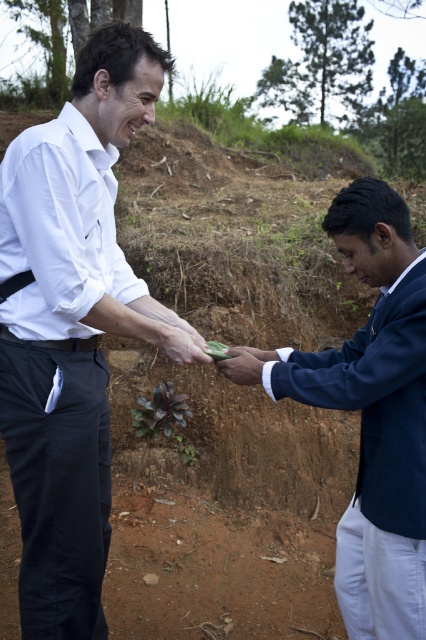
Is smooth skin hand at center shorter than matte green leaf at center?

No, smooth skin hand at center is not shorter than matte green leaf at center.

Between smooth skin hand at center and matte green leaf at center, which one is positioned higher?

smooth skin hand at center is higher up.

Who is more distant from viewer, (204, 360) or (216, 364)?

Point (216, 364)

What are the coordinates of `smooth skin hand at center` in the screenshot? It's located at (181, 342).

Does point (388, 259) come closer to viewer compared to point (97, 339)?

That is True.

Is navy blue jacket at center closer to the viewer compared to black leather belt at center?

That is True.

Identify the location of navy blue jacket at center. Image resolution: width=426 pixels, height=640 pixels. (376, 413).

Is white matte shirt at center to the right of smooth skin hand at center from the viewer's perspective?

Incorrect, white matte shirt at center is not on the right side of smooth skin hand at center.

Is point (74, 401) farther from camera compared to point (184, 344)?

No, it is not.

Describe the element at coordinates (80, 198) in the screenshot. I see `white matte shirt at center` at that location.

At what (x,y) coordinates should I click in order to perform the action: click on white matte shirt at center. Please return your answer as a coordinate pair (x, y). This screenshot has width=426, height=640. Looking at the image, I should click on (80, 198).